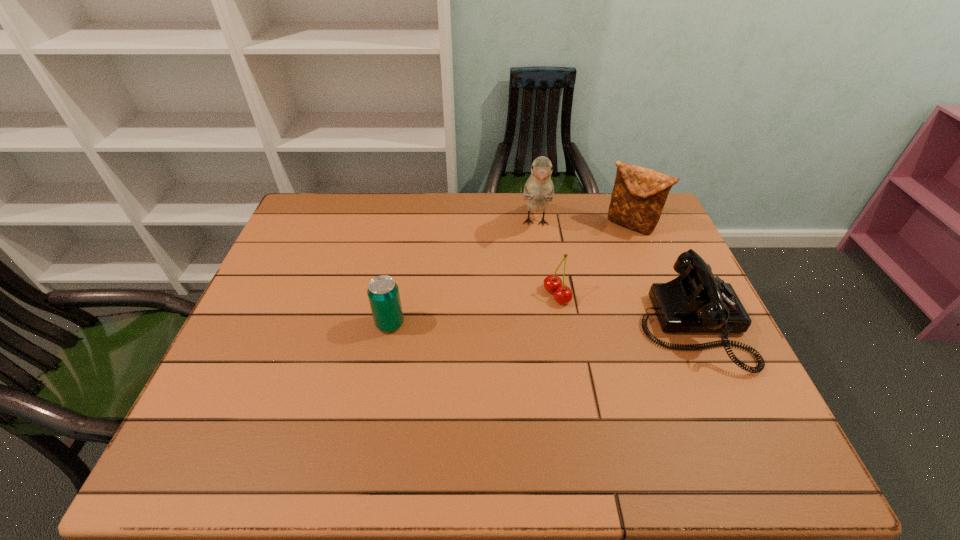
Locate an element on the screen. free space between the leftmost object and the second tallest object is located at coordinates [510, 274].

Image resolution: width=960 pixels, height=540 pixels. Identify the location of free space that is in between the telephone and the fourth shortest object. (660, 275).

At what (x,y) coordinates should I click in order to perform the action: click on vacant space that's between the telephone and the bird. Please return your answer as a coordinate pair (x, y). The image size is (960, 540). Looking at the image, I should click on (613, 274).

Where is `free point between the leftmost object and the cherry`? free point between the leftmost object and the cherry is located at coordinates (x=473, y=309).

Locate an element on the screen. The height and width of the screenshot is (540, 960). free space between the fourth shortest object and the cherry is located at coordinates pos(593,260).

Locate which object ranks second in proximity to the second tallest object. Please provide its 2D coordinates. Your answer should be formatted as a tuple, i.e. [(x, y)], where the tuple contains the x and y coordinates of a point satisfying the conditions above.

[(696, 301)]

Find the location of a particular element. This screenshot has height=540, width=960. object that stands as the fourth closest to the telephone is located at coordinates (383, 293).

The height and width of the screenshot is (540, 960). I want to click on free location that satisfies the following two spatial constraints: 1. on the front side of the bird; 2. on the right side of the second tallest object, so click(536, 225).

Where is `vacant region that satisfies the following two spatial constraints: 1. on the front side of the telephone; 2. on the dial of the clutch bag`? vacant region that satisfies the following two spatial constraints: 1. on the front side of the telephone; 2. on the dial of the clutch bag is located at coordinates (671, 325).

At what (x,y) coordinates should I click in order to perform the action: click on free space that satisfies the following two spatial constraints: 1. on the back side of the cherry; 2. on the left side of the beer can. Please return your answer as a coordinate pair (x, y). The width and height of the screenshot is (960, 540). Looking at the image, I should click on (396, 295).